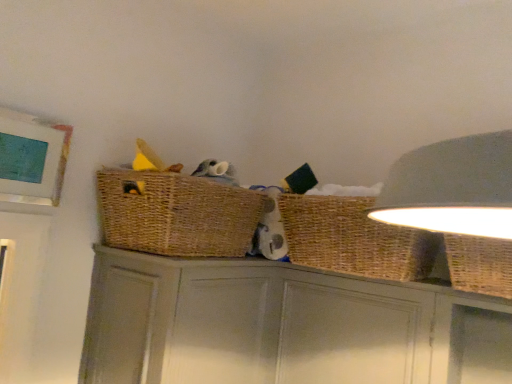
The height and width of the screenshot is (384, 512). What are the coordinates of `woven brown basket at upper center` in the screenshot? It's located at (176, 214).

The height and width of the screenshot is (384, 512). In order to click on woven wicker basket at right, which is the second basket in right-to-left order in this screenshot , I will do `click(353, 239)`.

What's the angular difference between woven wicker basket at right, the first basket from the left, and woven wicker basket at upper right, acting as the second basket starting from the left,'s facing directions?

woven wicker basket at right, the first basket from the left, and woven wicker basket at upper right, acting as the second basket starting from the left, are facing 0.000125 degrees away from each other.

Is woven wicker basket at right, which is the second basket in right-to-left order, next to woven wicker basket at upper right, acting as the second basket starting from the left?

They are not placed beside each other.

In terms of size, does woven wicker basket at right, which is the second basket in right-to-left order, appear bigger or smaller than woven wicker basket at upper right, acting as the second basket starting from the left?

Clearly, woven wicker basket at right, which is the second basket in right-to-left order, is larger in size than woven wicker basket at upper right, acting as the second basket starting from the left.

Measure the distance from woven wicker basket at right, which is the second basket in right-to-left order, to woven wicker basket at upper right, which is counted as the first basket, starting from the right.

The distance of woven wicker basket at right, which is the second basket in right-to-left order, from woven wicker basket at upper right, which is counted as the first basket, starting from the right, is 9.01 inches.

Which object is thinner, matte gray cabinet at center or woven wicker basket at upper right, which is counted as the first basket, starting from the right?

With smaller width is woven wicker basket at upper right, which is counted as the first basket, starting from the right.

Consider the image. Considering the positions of objects matte gray cabinet at center and woven wicker basket at upper right, acting as the second basket starting from the left, in the image provided, who is in front, matte gray cabinet at center or woven wicker basket at upper right, acting as the second basket starting from the left,?

woven wicker basket at upper right, acting as the second basket starting from the left, is closer to the camera.

Would you say matte gray cabinet at center is inside or outside woven wicker basket at upper right, which is counted as the first basket, starting from the right?

matte gray cabinet at center is spatially situated outside woven wicker basket at upper right, which is counted as the first basket, starting from the right.

Is woven wicker basket at upper right, acting as the second basket starting from the left, spatially inside woven wicker basket at right, the first basket from the left, or outside of it?

woven wicker basket at upper right, acting as the second basket starting from the left, lies outside woven wicker basket at right, the first basket from the left.

In the scene shown: From the image's perspective, is woven wicker basket at upper right, which is counted as the first basket, starting from the right, located above or below woven wicker basket at right, the first basket from the left?

Based on their image positions, woven wicker basket at upper right, which is counted as the first basket, starting from the right, is located beneath woven wicker basket at right, the first basket from the left.

Is woven wicker basket at upper right, which is counted as the first basket, starting from the right, taller or shorter than woven wicker basket at right, which is the second basket in right-to-left order?

Clearly, woven wicker basket at upper right, which is counted as the first basket, starting from the right, is shorter compared to woven wicker basket at right, which is the second basket in right-to-left order.

Is woven wicker basket at upper right, acting as the second basket starting from the left, far from woven wicker basket at right, the first basket from the left?

They are positioned close to each other.

How many degrees apart are the facing directions of woven brown basket at upper center and woven wicker basket at upper right, acting as the second basket starting from the left?

90.7 degrees.

From the image's perspective, is woven brown basket at upper center on woven wicker basket at upper right, acting as the second basket starting from the left?

Correct, woven brown basket at upper center appears higher than woven wicker basket at upper right, acting as the second basket starting from the left, in the image.

Measure the distance between woven brown basket at upper center and woven wicker basket at upper right, which is counted as the first basket, starting from the right.

64.26 centimeters.

Is woven brown basket at upper center not within woven wicker basket at upper right, acting as the second basket starting from the left?

Yes, woven brown basket at upper center is not within woven wicker basket at upper right, acting as the second basket starting from the left.

Considering the positions of points (505, 259) and (199, 262), is point (505, 259) closer to camera compared to point (199, 262)?

Yes.

Can you confirm if woven wicker basket at upper right, acting as the second basket starting from the left, is taller than matte gray cabinet at center?

No.

Is woven wicker basket at upper right, acting as the second basket starting from the left, aimed at matte gray cabinet at center?

No, woven wicker basket at upper right, acting as the second basket starting from the left, is not facing towards matte gray cabinet at center.

From a real-world perspective, is woven brown basket at upper center positioned under matte gray cabinet at center based on gravity?

Actually, woven brown basket at upper center is physically above matte gray cabinet at center in the real world.

Considering the relative sizes of woven brown basket at upper center and matte gray cabinet at center in the image provided, is woven brown basket at upper center shorter than matte gray cabinet at center?

Correct, woven brown basket at upper center is not as tall as matte gray cabinet at center.

Is woven brown basket at upper center far from matte gray cabinet at center?

No.

What's the angular difference between woven brown basket at upper center and matte gray cabinet at center's facing directions?

They differ by 0.787 degrees in their facing directions.

Can we say woven brown basket at upper center lies outside woven wicker basket at right, which is the second basket in right-to-left order?

Yes, woven brown basket at upper center is not within woven wicker basket at right, which is the second basket in right-to-left order.

Which point is more forward, (120,235) or (338,268)?

Positioned in front is point (120,235).

Which object is positioned more to the right, woven brown basket at upper center or woven wicker basket at right, the first basket from the left?

woven wicker basket at right, the first basket from the left, is more to the right.

From the image's perspective, is woven brown basket at upper center over woven wicker basket at right, the first basket from the left?

Yes.

At what (x,y) coordinates should I click in order to perform the action: click on basket on the left side of woven wicker basket at upper right, acting as the second basket starting from the left. Please return your answer as a coordinate pair (x, y). Image resolution: width=512 pixels, height=384 pixels. Looking at the image, I should click on (353, 239).

This screenshot has height=384, width=512. Identify the location of cabinetry below the woven wicker basket at upper right, which is counted as the first basket, starting from the right (from the image's perspective). (282, 326).

From the image, which object appears to be farther from matte gray cabinet at center, woven wicker basket at right, the first basket from the left, or woven wicker basket at upper right, which is counted as the first basket, starting from the right?

Based on the image, woven wicker basket at upper right, which is counted as the first basket, starting from the right, appears to be further to matte gray cabinet at center.

When comparing their distances from woven wicker basket at upper right, which is counted as the first basket, starting from the right, does woven brown basket at upper center or matte gray cabinet at center seem further?

woven brown basket at upper center.

Estimate the real-world distances between objects in this image. Which object is further from woven brown basket at upper center, woven wicker basket at upper right, acting as the second basket starting from the left, or matte gray cabinet at center?

Among the two, woven wicker basket at upper right, acting as the second basket starting from the left, is located further to woven brown basket at upper center.

Estimate the real-world distances between objects in this image. Which object is closer to woven wicker basket at upper right, acting as the second basket starting from the left, matte gray cabinet at center or woven brown basket at upper center?

matte gray cabinet at center is closer to woven wicker basket at upper right, acting as the second basket starting from the left.

Considering their positions, is woven brown basket at upper center positioned further to woven wicker basket at right, which is the second basket in right-to-left order, than woven wicker basket at upper right, acting as the second basket starting from the left?

woven brown basket at upper center.

Which object lies further to the anchor point woven wicker basket at upper right, which is counted as the first basket, starting from the right, woven wicker basket at right, which is the second basket in right-to-left order, or woven brown basket at upper center?

The object further to woven wicker basket at upper right, which is counted as the first basket, starting from the right, is woven brown basket at upper center.

Looking at the image, which one is located further to woven wicker basket at upper right, which is counted as the first basket, starting from the right, matte gray cabinet at center or woven wicker basket at right, the first basket from the left?

matte gray cabinet at center is positioned further to the anchor woven wicker basket at upper right, which is counted as the first basket, starting from the right.

When comparing their distances from woven wicker basket at right, which is the second basket in right-to-left order, does matte gray cabinet at center or woven brown basket at upper center seem further?

Among the two, woven brown basket at upper center is located further to woven wicker basket at right, which is the second basket in right-to-left order.

The width and height of the screenshot is (512, 384). I want to click on cabinetry between woven brown basket at upper center and woven wicker basket at upper right, acting as the second basket starting from the left, from left to right, so click(x=282, y=326).

Locate an element on the screen. The height and width of the screenshot is (384, 512). basket between matte gray cabinet at center and woven wicker basket at upper right, acting as the second basket starting from the left is located at coordinates point(353,239).

Locate an element on the screen. The image size is (512, 384). basket between woven brown basket at upper center and woven wicker basket at upper right, which is counted as the first basket, starting from the right is located at coordinates 353,239.

Where is `cabinetry located between woven brown basket at upper center and woven wicker basket at right, which is the second basket in right-to-left order, in the left-right direction`? cabinetry located between woven brown basket at upper center and woven wicker basket at right, which is the second basket in right-to-left order, in the left-right direction is located at coordinates (282, 326).